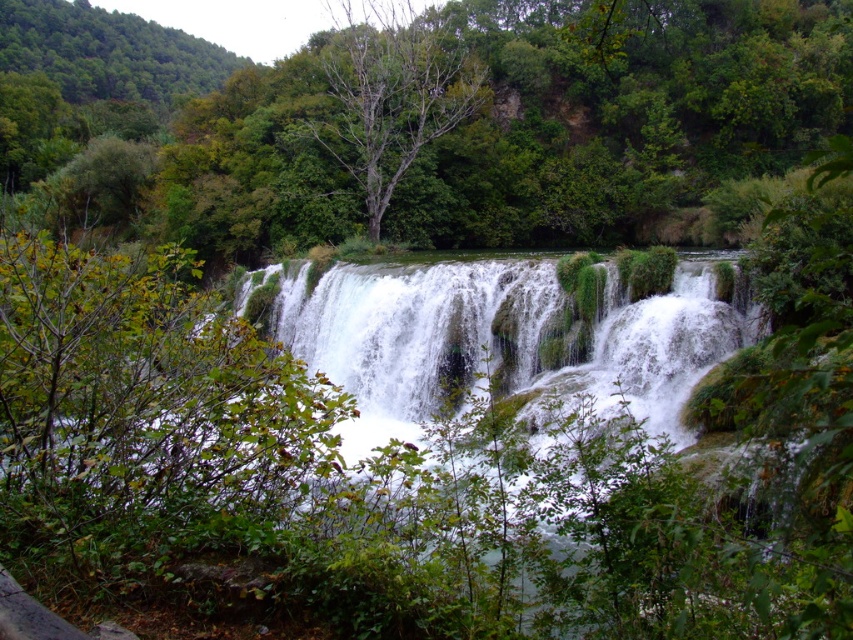
Question: Where is green leafy tree at center located in relation to white frothy water at center in the image?

Choices:
 (A) below
 (B) above

Answer: (B)

Question: Does green leafy tree at center have a lesser width compared to white frothy water at center?

Choices:
 (A) no
 (B) yes

Answer: (A)

Question: Which point appears closest to the camera in this image?

Choices:
 (A) (518, 145)
 (B) (416, 396)

Answer: (B)

Question: Which object is the farthest from the white frothy water at center?

Choices:
 (A) bare wood tree at center
 (B) green leafy tree at center

Answer: (B)

Question: Can you confirm if white frothy water at center is bigger than bare wood tree at center?

Choices:
 (A) no
 (B) yes

Answer: (A)

Question: Which object appears farthest from the camera in this image?

Choices:
 (A) white frothy water at center
 (B) bare wood tree at center

Answer: (B)